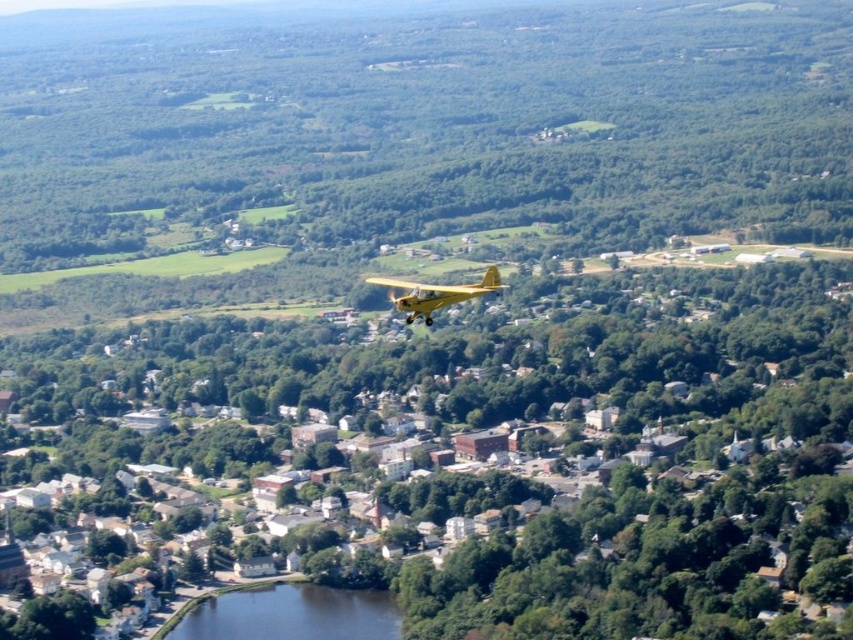
Question: Which of the following is the farthest from the observer?

Choices:
 (A) (393, 611)
 (B) (425, 301)

Answer: (A)

Question: Observing the image, what is the correct spatial positioning of dark blue water at lower center in reference to yellow matte airplane at center?

Choices:
 (A) right
 (B) left

Answer: (B)

Question: Among these objects, which one is farthest from the camera?

Choices:
 (A) dark blue water at lower center
 (B) yellow matte airplane at center

Answer: (A)

Question: Is dark blue water at lower center below yellow matte airplane at center?

Choices:
 (A) no
 (B) yes

Answer: (B)

Question: In this image, where is dark blue water at lower center located relative to yellow matte airplane at center?

Choices:
 (A) above
 (B) below

Answer: (B)